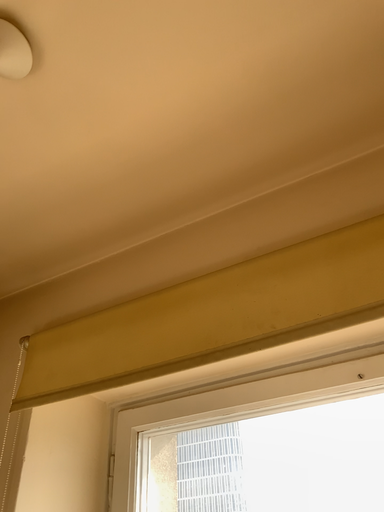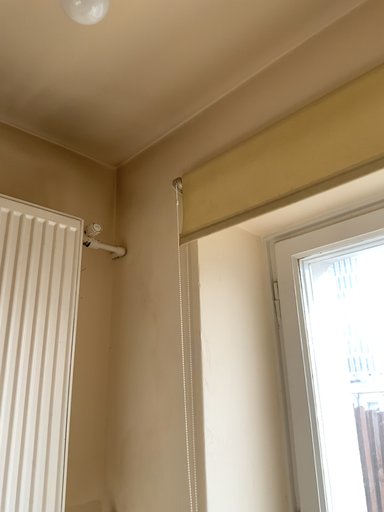
Question: How did the camera likely rotate when shooting the video?

Choices:
 (A) rotated right
 (B) rotated left

Answer: (B)